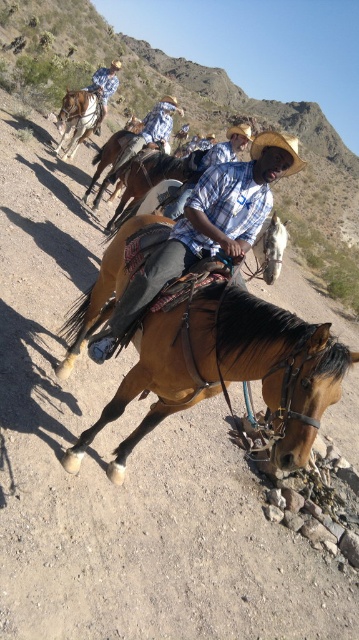
Who is taller, brown leather saddle at center or light blue plaid shirt at center?

light blue plaid shirt at center

Image resolution: width=359 pixels, height=640 pixels. I want to click on brown leather saddle at center, so click(226, 368).

I want to click on brown leather saddle at center, so click(x=226, y=368).

Does brown leather saddle at center have a greater width compared to matte blue plaid shirt at center?

Correct, the width of brown leather saddle at center exceeds that of matte blue plaid shirt at center.

Which is below, brown leather saddle at center or matte blue plaid shirt at center?

Positioned lower is brown leather saddle at center.

Is point (173, 326) closer to camera compared to point (190, 216)?

That is True.

Find the location of a particular element. The image size is (359, 640). brown leather saddle at center is located at coordinates (226, 368).

Consider the image. Does brown leather horse at center have a lesser height compared to brown leather saddle at upper left?

In fact, brown leather horse at center may be taller than brown leather saddle at upper left.

Who is more forward, [222,92] or [64,99]?

Point [64,99] is in front.

Find the location of a particular element. This screenshot has height=640, width=359. brown leather horse at center is located at coordinates (198, 118).